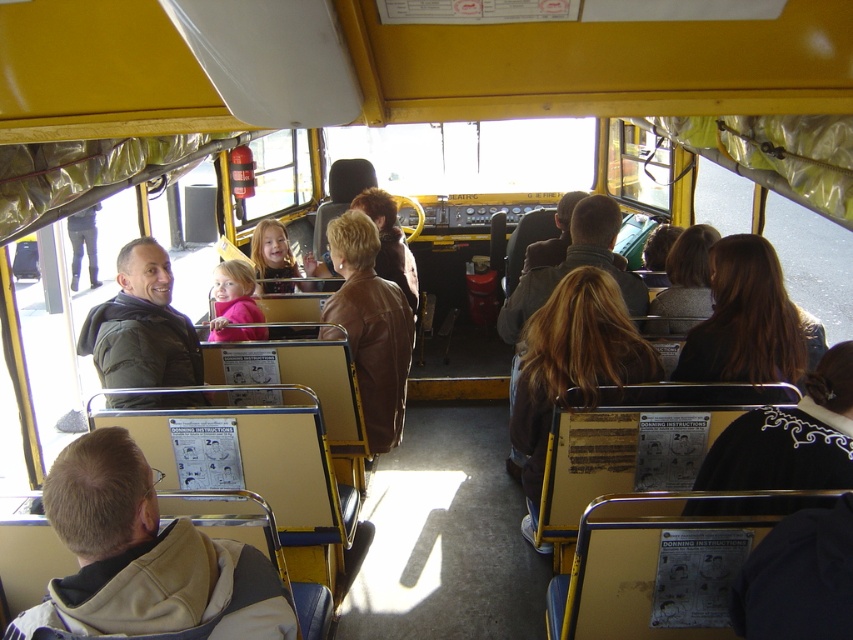
Question: Is black leather jacket at lower right above black matte jacket at left?

Choices:
 (A) yes
 (B) no

Answer: (B)

Question: Which object appears closest to the camera in this image?

Choices:
 (A) black leather jacket at lower right
 (B) beige fabric jacket at lower left
 (C) brown leather jacket at center
 (D) dark brown leather jacket at upper right

Answer: (B)

Question: Which point is farther to the camera?

Choices:
 (A) blonde hair at center
 (B) dark brown leather jacket at upper right

Answer: (B)

Question: Does blonde hair at center have a greater width compared to black matte jacket at left?

Choices:
 (A) no
 (B) yes

Answer: (B)

Question: Which of the following is the farthest from the observer?

Choices:
 (A) (340, 214)
 (B) (817, 422)
 (C) (195, 540)

Answer: (A)

Question: Is black leather jacket at lower right positioned in front of dark brown leather jacket at upper right?

Choices:
 (A) yes
 (B) no

Answer: (A)